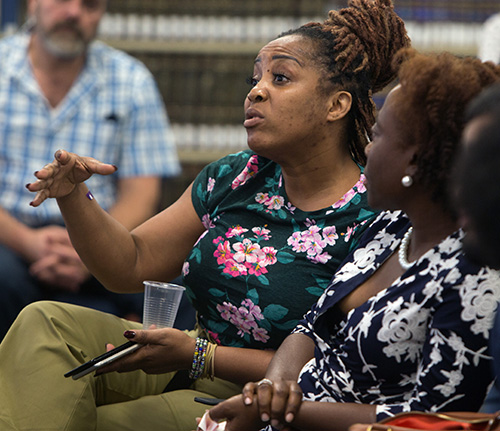
The height and width of the screenshot is (431, 500). In order to click on phone in this screenshot , I will do `click(114, 354)`.